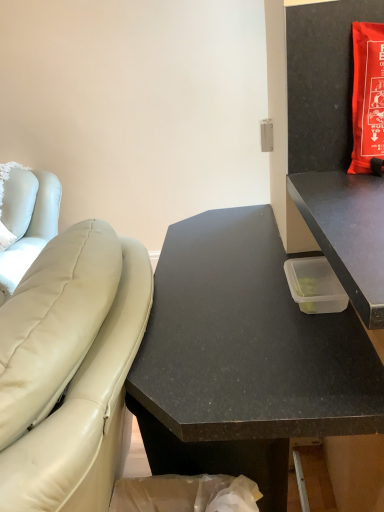
What do you see at coordinates (247, 342) in the screenshot?
I see `black granite table at center` at bounding box center [247, 342].

Image resolution: width=384 pixels, height=512 pixels. What are the coordinates of `black granite table at center` in the screenshot? It's located at (247, 342).

What is the approximate width of black granite table at center?

18.09 inches.

The image size is (384, 512). I want to click on black granite table at center, so click(247, 342).